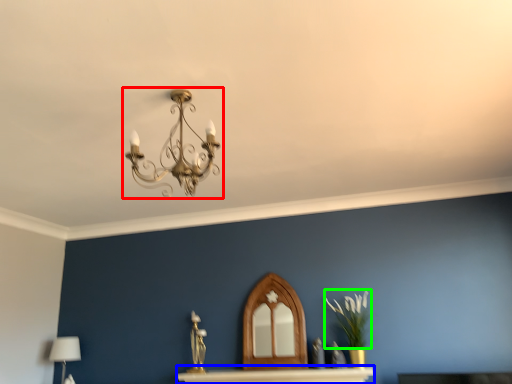
Question: Estimate the real-world distances between objects in this image. Which object is farther from lamp (highlighted by a red box), table (highlighted by a blue box) or plant (highlighted by a green box)?

Choices:
 (A) table
 (B) plant

Answer: (B)